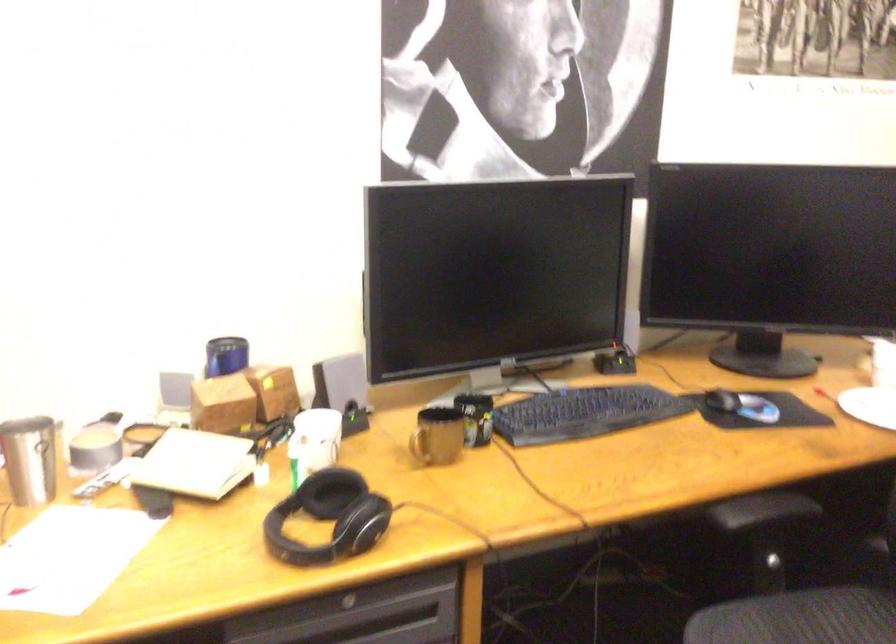
Find where to pull the desk drawer handle. Please return your answer as a coordinate pair (x, y).

(347, 603)